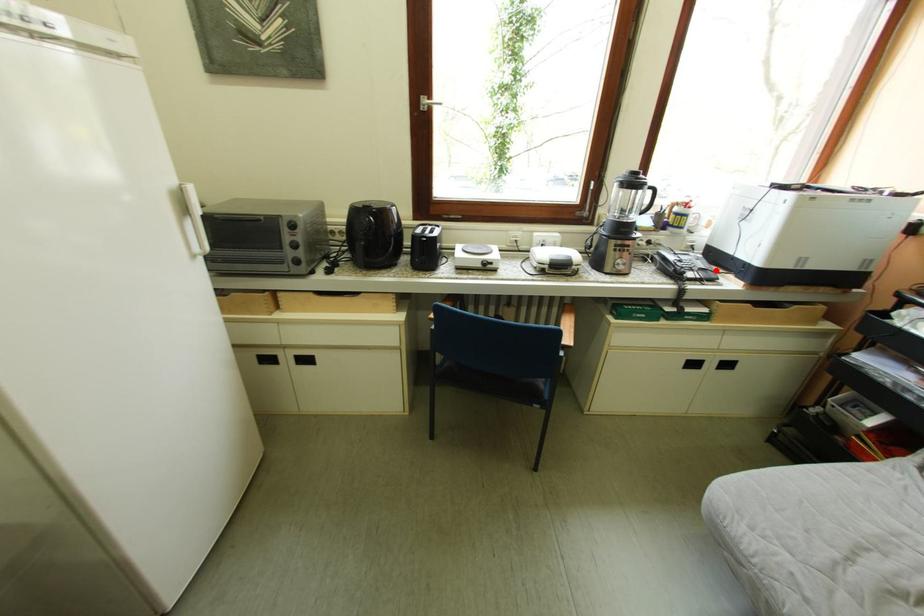
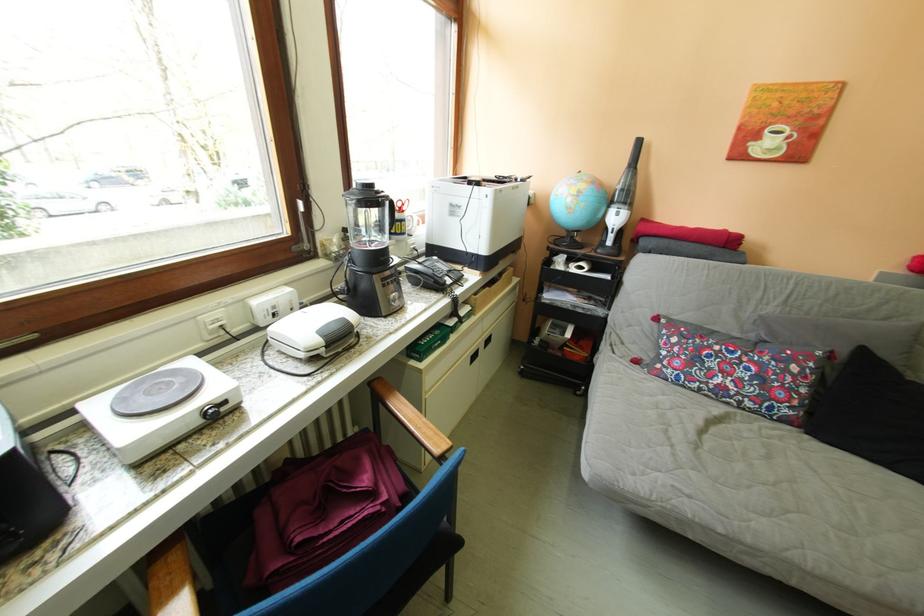
Find the pixel in the second image that matches the highlighted location in the first image.

(460, 272)